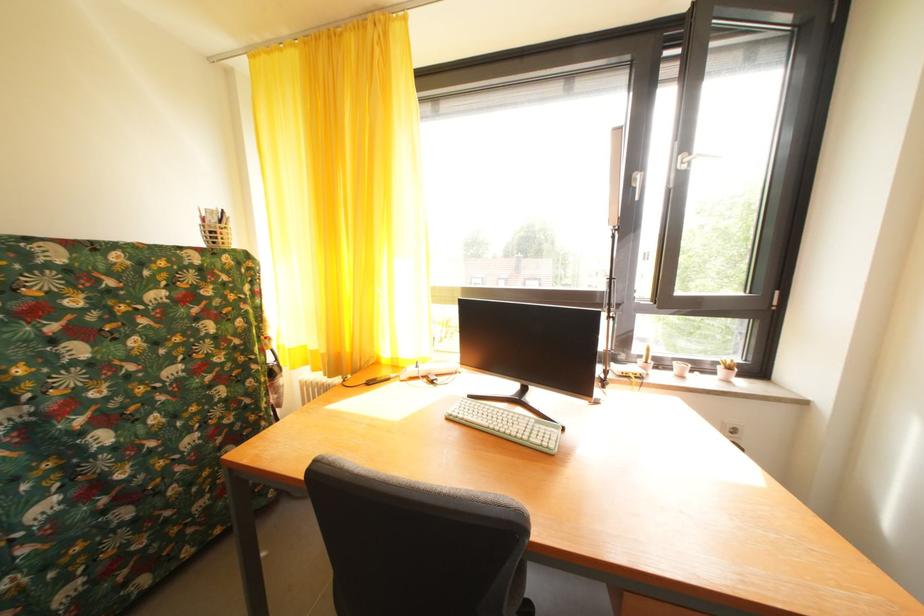
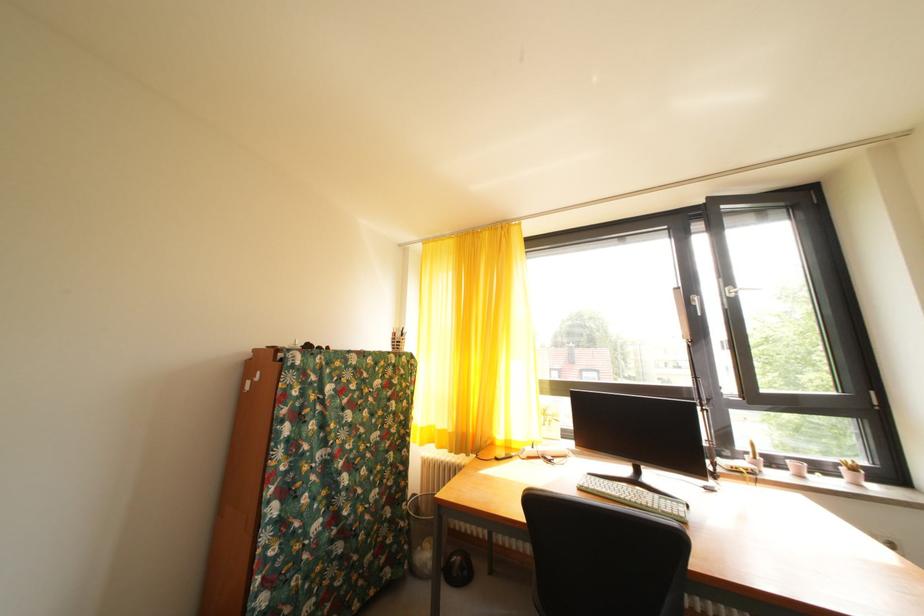
In a continuous first-person perspective shot, in which direction is the camera moving?

The movement direction of the cameraman is left, backward.